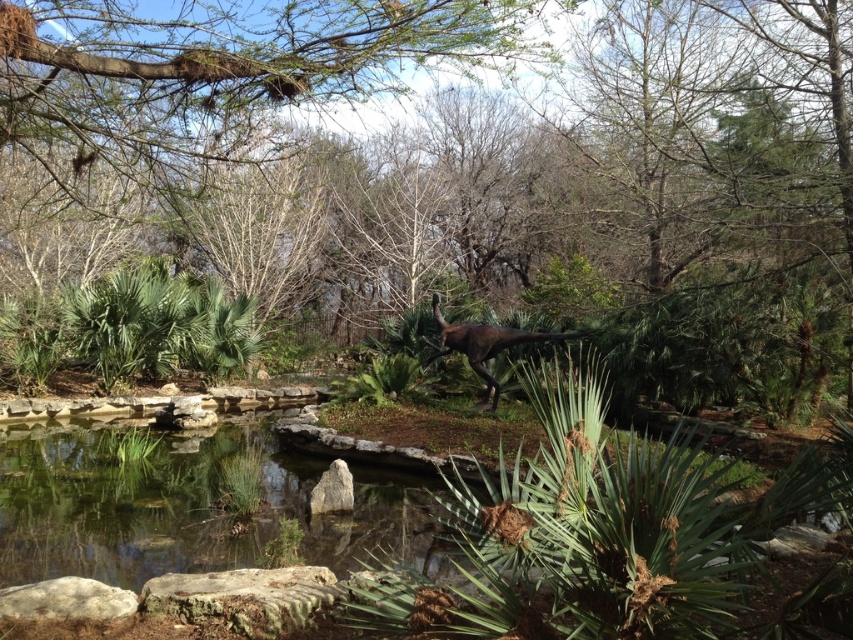
Looking at this image, you are standing at the camera position and want to take a photo of the green leafy tree at center. If your camera has a maximum focus range of 3 meters, will you be able to capture the tree clearly?

The green leafy tree at center is 3.18 meters away from the camera. Since the camera can only focus up to 3 meters, it won cannot capture the tree clearly.

You are a tour guide leading a group of children through the park. You want to ensure they can safely walk between the shiny brown dinosaur at center and the gray rough rock at center. What is the minimum width of the path required for this? The children are holding hands in a line, and each child occupies 1.5 feet of space. There are 8 children in the line.

The distance between the shiny brown dinosaur at center and the gray rough rock at center is 13.39 feet. Since the children are holding hands in a line and each occupies 1.5 feet, the total space needed is 8 children multiplied by 1.5 feet per child, which equals 12 feet. Therefore, the path must be at least 12 feet wide to accommodate the children safely.